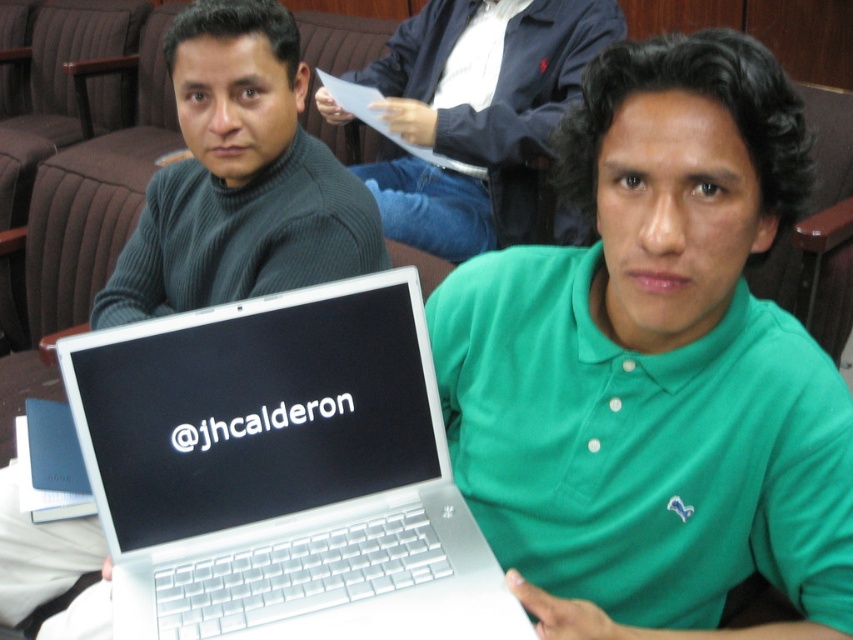
Question: Does silver metallic laptop at center lie in front of dark blue jacket at upper center?

Choices:
 (A) yes
 (B) no

Answer: (A)

Question: Which object appears closest to the camera in this image?

Choices:
 (A) dark blue jacket at upper center
 (B) silver metallic laptop at center

Answer: (B)

Question: Estimate the real-world distances between objects in this image. Which object is farther from the dark blue jacket at upper center?

Choices:
 (A) silver metallic laptop at center
 (B) matte gray sweater at left

Answer: (A)

Question: Can you confirm if silver metallic laptop at center is thinner than dark blue jacket at upper center?

Choices:
 (A) yes
 (B) no

Answer: (A)

Question: Considering the real-world distances, which object is farthest from the dark blue jacket at upper center?

Choices:
 (A) silver metallic laptop at center
 (B) matte gray sweater at left

Answer: (A)

Question: Does silver metallic laptop at center have a greater width compared to dark blue jacket at upper center?

Choices:
 (A) yes
 (B) no

Answer: (B)